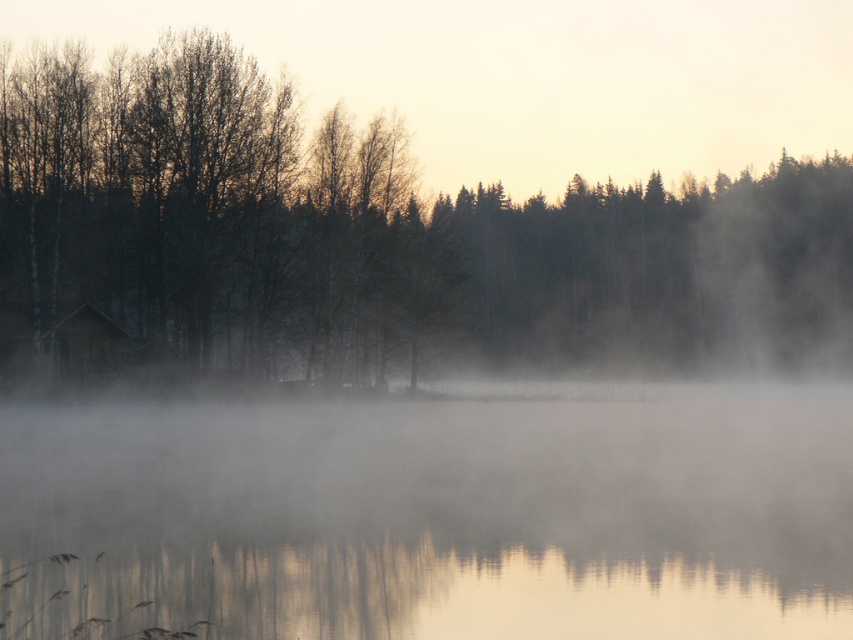
Consider the image. You are standing in the serene landscape scene. You want to walk from your current position towards the silhouette bark tree at left. Will you first step onto the transparent misty water at center before reaching the tree?

The transparent misty water at center is closer to the viewer than the silhouette bark tree at left. So, yes, you would first step onto the transparent misty water at center before reaching the silhouette bark tree at left.

You are an observer standing at the edge of the water. Which object, the transparent misty water at center or the silhouette bark tree at left, is closer to you?

The transparent misty water at center is closer to you because it is located below the silhouette bark tree at left, placing it in the foreground.

You are standing in the serene landscape scene. There are two points marked in the image. The first point is at coordinate point[398,621] and the second at point[846,246]. Which point is closer to you?

Point[398,621] is closer to the viewer than point[846,246].